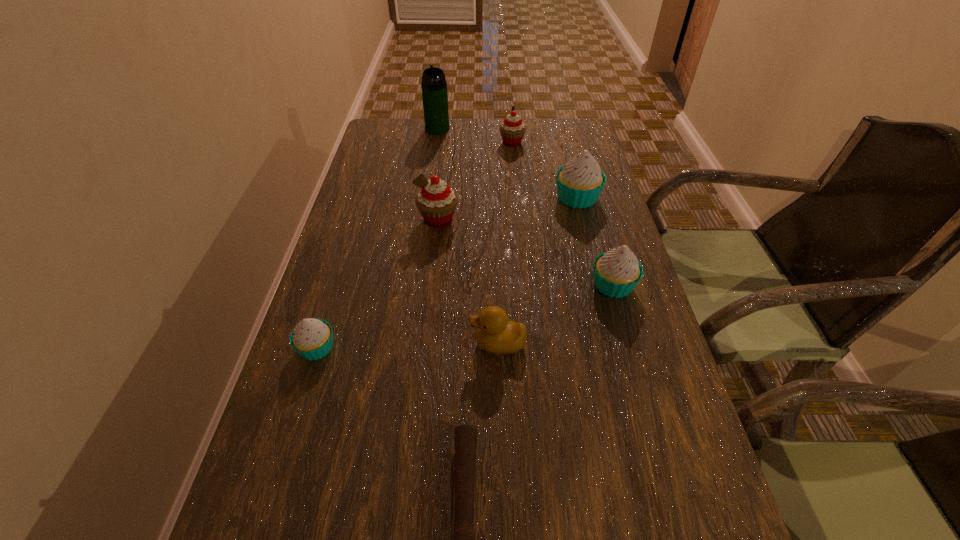
The width and height of the screenshot is (960, 540). I want to click on white cupcake identified as the second closest to the shortest object, so click(x=617, y=272).

Locate an element on the screen. This screenshot has height=540, width=960. white cupcake that is the third nearest to the smaller pink cupcake is located at coordinates (312, 339).

This screenshot has height=540, width=960. Identify the location of free location that satisfies the following two spatial constraints: 1. from the spout of the second farthest object; 2. on the left side of the farthest object. (436, 143).

Find the location of a particular element. vacant point that satisfies the following two spatial constraints: 1. from the spout of the seventh nearest object; 2. on the right side of the green thermos bottle is located at coordinates (436, 143).

Find the location of a particular element. blank area in the image that satisfies the following two spatial constraints: 1. on the back side of the nearest white cupcake; 2. on the right side of the fourth farthest cupcake is located at coordinates (336, 285).